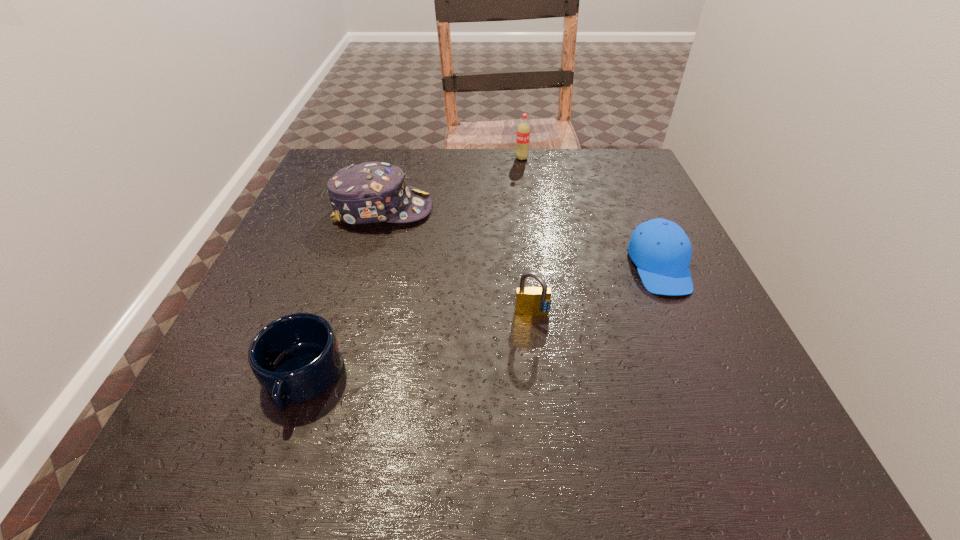
Where is `vacant space at the far edge of the desktop`? This screenshot has width=960, height=540. vacant space at the far edge of the desktop is located at coordinates (458, 152).

What are the coordinates of `vacant space at the near edge of the desktop` in the screenshot? It's located at (294, 473).

Where is `vacant space at the right edge of the desktop`? vacant space at the right edge of the desktop is located at coordinates (684, 336).

This screenshot has height=540, width=960. I want to click on vacant space at the far right corner of the desktop, so click(620, 171).

Where is `free space between the second nearest object and the left cap`? free space between the second nearest object and the left cap is located at coordinates (458, 262).

Find the location of a particular element. The image size is (960, 540). free point between the farthest object and the mug is located at coordinates (412, 268).

The image size is (960, 540). What are the coordinates of `free space between the nearer cap and the fourth farthest object` in the screenshot? It's located at (596, 291).

Locate an element on the screen. The image size is (960, 540). vacant area that lies between the mug and the shorter cap is located at coordinates (481, 322).

Find the location of a particular element. The image size is (960, 540). vacant space that is in between the nearest object and the taller cap is located at coordinates (342, 294).

Identify the location of vacant space that is in between the nearest object and the padlock. Image resolution: width=960 pixels, height=540 pixels. (418, 347).